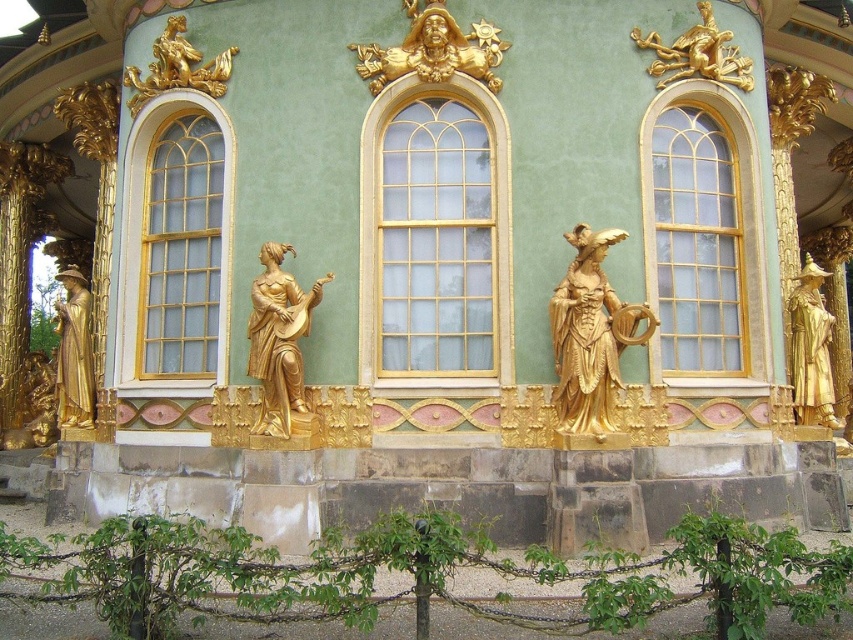
Question: Which of the following is the closest to the observer?

Choices:
 (A) clear glass window at center
 (B) clear glass window at center right

Answer: (A)

Question: Is gold/gilded statue at center closer to the viewer compared to gold polished statue at right?

Choices:
 (A) yes
 (B) no

Answer: (A)

Question: Which point appears closest to the camera in this image?

Choices:
 (A) (215, 76)
 (B) (308, 435)
 (C) (370, 83)

Answer: (B)

Question: Does clear glass window at center appear on the left side of gold polished statue at right?

Choices:
 (A) no
 (B) yes

Answer: (B)

Question: Does gold/gilded statue at center have a greater width compared to gold polished statue at right?

Choices:
 (A) no
 (B) yes

Answer: (A)

Question: Estimate the real-world distances between objects in this image. Which object is farther from the gold/gilded statue at center?

Choices:
 (A) gold polished wood statue at center
 (B) gold/gilded statue at upper left
 (C) clear glass window at center left

Answer: (C)